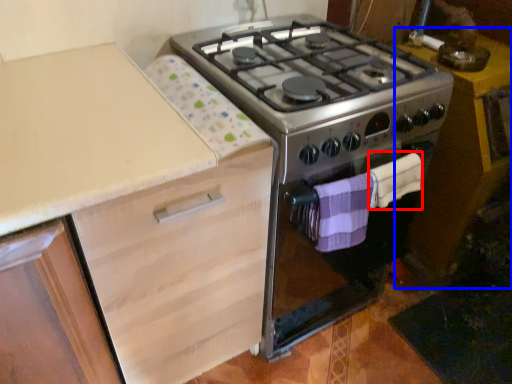
Question: Which of the following is the farthest to the observer, blanket (highlighted by a red box) or table (highlighted by a blue box)?

Choices:
 (A) blanket
 (B) table

Answer: (B)